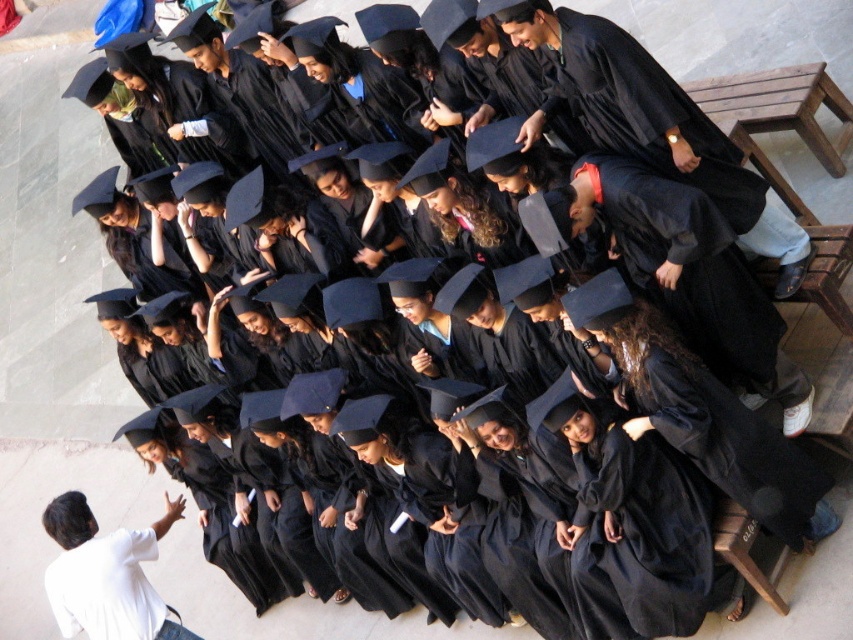
Is matte black robe at center to the left of white matte shirt at lower left from the viewer's perspective?

In fact, matte black robe at center is to the right of white matte shirt at lower left.

Locate an element on the screen. The image size is (853, 640). matte black robe at center is located at coordinates (660, 124).

The height and width of the screenshot is (640, 853). What do you see at coordinates (660, 124) in the screenshot?
I see `matte black robe at center` at bounding box center [660, 124].

Image resolution: width=853 pixels, height=640 pixels. I want to click on matte black robe at center, so click(660, 124).

Does matte black graduation gown at center have a greater height compared to matte black robe at center?

No, matte black graduation gown at center is not taller than matte black robe at center.

Which is below, matte black graduation gown at center or matte black robe at center?

matte black graduation gown at center is lower down.

Which is in front, point (599, 186) or point (599, 70)?

Point (599, 186) is in front.

In order to click on matte black graduation gown at center in this screenshot , I will do `click(689, 273)`.

Is matte black graduation gown at center further to camera compared to white matte shirt at lower left?

No, matte black graduation gown at center is in front of white matte shirt at lower left.

Describe the element at coordinates (689, 273) in the screenshot. I see `matte black graduation gown at center` at that location.

Describe the element at coordinates (689, 273) in the screenshot. I see `matte black graduation gown at center` at that location.

At what (x,y) coordinates should I click in order to perform the action: click on matte black graduation gown at center. Please return your answer as a coordinate pair (x, y). This screenshot has height=640, width=853. Looking at the image, I should click on (689, 273).